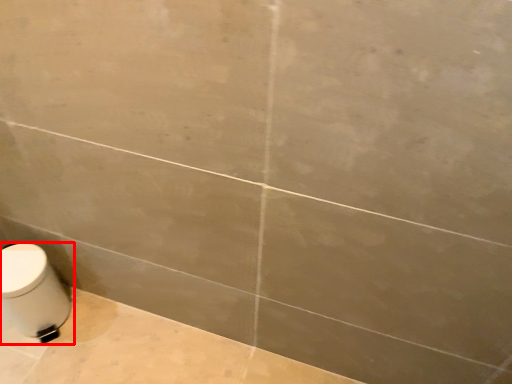
Question: In this image, where is toilet (annotated by the red box) located relative to bath?

Choices:
 (A) right
 (B) left

Answer: (B)